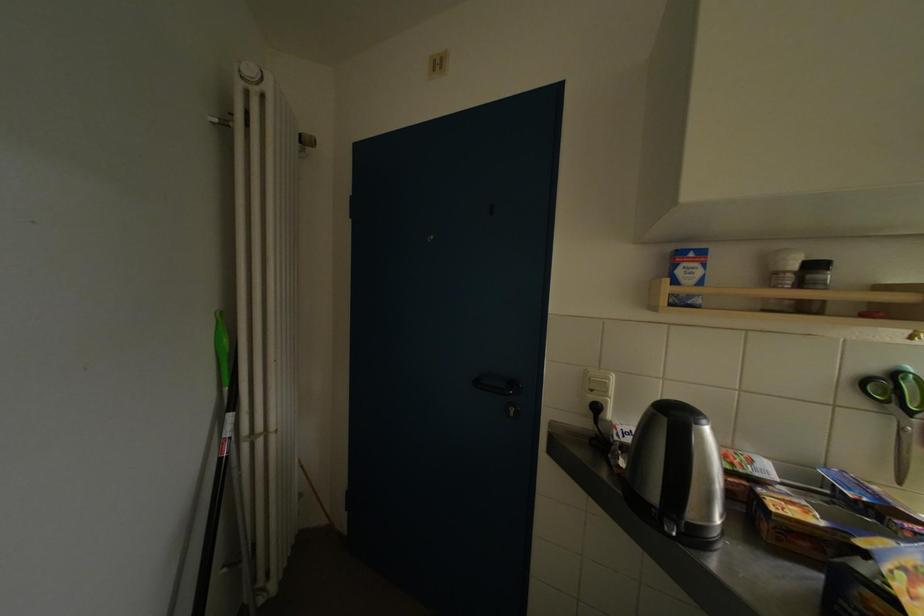
What do you see at coordinates (675, 469) in the screenshot? The height and width of the screenshot is (616, 924). I see `the electric kettle handle` at bounding box center [675, 469].